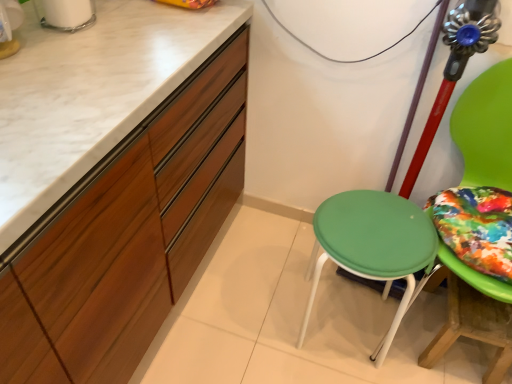
Measure the distance between wooden table at lower right and camera.

wooden table at lower right is 1.12 meters away from camera.

The height and width of the screenshot is (384, 512). I want to click on green plastic chair at right, so click(x=486, y=128).

Describe the element at coordinates (113, 181) in the screenshot. I see `matte wood cabinetry at left` at that location.

Find the location of `green plastic stool at center`. green plastic stool at center is located at coordinates (372, 246).

How much distance is there between green plastic stool at center and matte wood cabinetry at left?

22.85 inches.

In terms of height, does green plastic stool at center look taller or shorter compared to matte wood cabinetry at left?

Considering their sizes, green plastic stool at center has less height than matte wood cabinetry at left.

Can you confirm if green plastic stool at center is wider than matte wood cabinetry at left?

Incorrect, the width of green plastic stool at center does not surpass that of matte wood cabinetry at left.

Considering the positions of point (322, 219) and point (29, 315), is point (322, 219) closer or farther from the camera than point (29, 315)?

Point (322, 219) is farther from the camera than point (29, 315).

How far apart are wooden table at lower right and matte wood cabinetry at left?

They are 35.98 inches apart.

From the image's perspective, between wooden table at lower right and matte wood cabinetry at left, who is located below?

From the image's view, wooden table at lower right is below.

From a real-world perspective, does wooden table at lower right sit lower than matte wood cabinetry at left?

Yes, from a real-world perspective, wooden table at lower right is beneath matte wood cabinetry at left.

Would you say wooden table at lower right is to the left or to the right of matte wood cabinetry at left in the picture?

wooden table at lower right is positioned on matte wood cabinetry at left's right side.

Is point (8, 356) more distant than point (469, 153)?

No, it is in front of (469, 153).

What's the angular difference between matte wood cabinetry at left and green plastic chair at right's facing directions?

There is a 88.5-degree angle between the facing directions of matte wood cabinetry at left and green plastic chair at right.

In terms of size, does matte wood cabinetry at left appear bigger or smaller than green plastic chair at right?

In the image, matte wood cabinetry at left appears to be larger than green plastic chair at right.

Is matte wood cabinetry at left behind green plastic chair at right?

No.

From the image's perspective, which object appears higher, wooden table at lower right or green plastic chair at right?

green plastic chair at right.

At what (x,y) coordinates should I click in order to perform the action: click on table below the green plastic chair at right (from the image's perspective). Please return your answer as a coordinate pair (x, y). This screenshot has width=512, height=384. Looking at the image, I should click on (471, 324).

Between wooden table at lower right and green plastic chair at right, which one has more height?

With more height is green plastic chair at right.

Between wooden table at lower right and green plastic chair at right, which one has smaller width?

wooden table at lower right is thinner.

Which of these two, matte wood cabinetry at left or wooden table at lower right, is bigger?

Bigger between the two is matte wood cabinetry at left.

Can you confirm if matte wood cabinetry at left is positioned to the left of wooden table at lower right?

Yes, matte wood cabinetry at left is to the left of wooden table at lower right.

Considering the positions of point (74, 274) and point (455, 335), is point (74, 274) closer or farther from the camera than point (455, 335)?

Point (74, 274) is closer to the camera than point (455, 335).

Which object is wider, matte wood cabinetry at left or wooden table at lower right?

Wider between the two is matte wood cabinetry at left.

From the image's perspective, is green plastic chair at right positioned above or below wooden table at lower right?

green plastic chair at right is situated higher than wooden table at lower right in the image.

Would you say green plastic chair at right is outside wooden table at lower right?

green plastic chair at right is positioned outside wooden table at lower right.

Is the depth of green plastic chair at right greater than that of wooden table at lower right?

No, it is in front of wooden table at lower right.

Locate an element on the screen. The height and width of the screenshot is (384, 512). chair lying below the matte wood cabinetry at left (from the image's perspective) is located at coordinates (486, 128).

Considering the positions of point (489, 137) and point (75, 337), is point (489, 137) closer or farther from the camera than point (75, 337)?

Clearly, point (489, 137) is more distant from the camera than point (75, 337).

From the picture: Who is taller, green plastic chair at right or matte wood cabinetry at left?

green plastic chair at right is taller.

Which of these two, green plastic chair at right or matte wood cabinetry at left, is smaller?

With smaller size is green plastic chair at right.

This screenshot has height=384, width=512. In the image, there is a green plastic stool at center. Find the location of `cabinetry above it (from the image's perspective)`. cabinetry above it (from the image's perspective) is located at coordinates (113, 181).

You are a GUI agent. You are given a task and a screenshot of the screen. Output one action in this format:
    pyautogui.click(x=<x>, y=<y>)
    Task: Click on the cabinetry above the wooden table at lower right (from a real-world perspective)
    
    Given the screenshot: What is the action you would take?
    pyautogui.click(x=113, y=181)

When comparing their distances from matte wood cabinetry at left, does wooden table at lower right or green plastic stool at center seem closer?

Based on the image, green plastic stool at center appears to be nearer to matte wood cabinetry at left.

Which object lies further to the anchor point matte wood cabinetry at left, green plastic stool at center or wooden table at lower right?

The object further to matte wood cabinetry at left is wooden table at lower right.

Considering their positions, is matte wood cabinetry at left positioned further to green plastic chair at right than wooden table at lower right?

matte wood cabinetry at left is positioned further to the anchor green plastic chair at right.

Based on the photo, estimate the real-world distances between objects in this image. Which object is further from green plastic stool at center, wooden table at lower right or matte wood cabinetry at left?

matte wood cabinetry at left is further to green plastic stool at center.

Considering their positions, is green plastic chair at right positioned closer to wooden table at lower right than green plastic stool at center?

Based on the image, green plastic stool at center appears to be nearer to wooden table at lower right.

From the image, which object appears to be farther from matte wood cabinetry at left, green plastic chair at right or wooden table at lower right?

green plastic chair at right.

Estimate the real-world distances between objects in this image. Which object is closer to matte wood cabinetry at left, green plastic stool at center or green plastic chair at right?

green plastic stool at center.

Considering their positions, is green plastic chair at right positioned further to wooden table at lower right than matte wood cabinetry at left?

Based on the image, matte wood cabinetry at left appears to be further to wooden table at lower right.

Identify the location of stool situated between matte wood cabinetry at left and green plastic chair at right from left to right. (372, 246).

Locate an element on the screen. chair located between matte wood cabinetry at left and wooden table at lower right in the left-right direction is located at coordinates (486, 128).

Where is `stool between green plastic chair at right and wooden table at lower right along the z-axis`? This screenshot has width=512, height=384. stool between green plastic chair at right and wooden table at lower right along the z-axis is located at coordinates (372, 246).

You are a GUI agent. You are given a task and a screenshot of the screen. Output one action in this format:
    pyautogui.click(x=<x>, y=<y>)
    Task: Click on the stool situated between matte wood cabinetry at left and wooden table at lower right from left to right
    This screenshot has height=384, width=512.
    Given the screenshot: What is the action you would take?
    pyautogui.click(x=372, y=246)